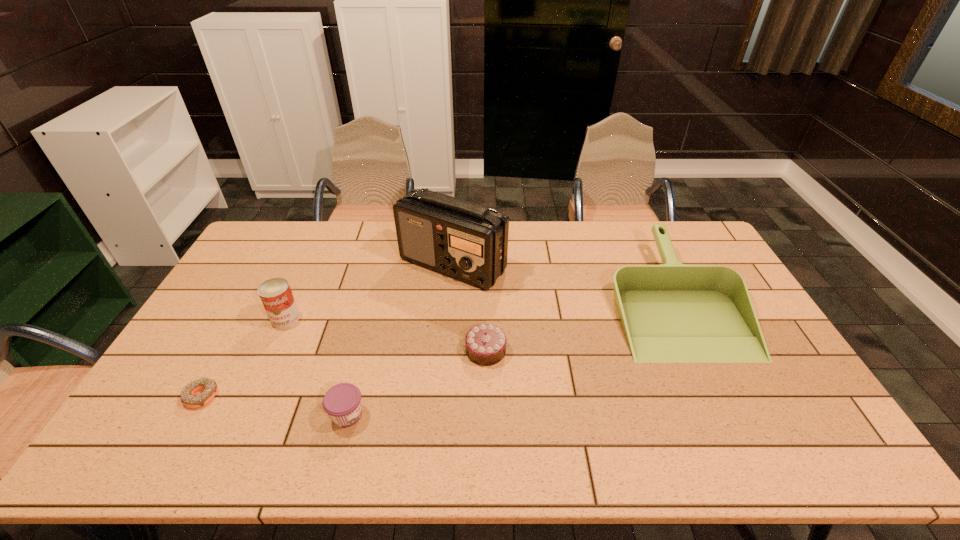
You are a GUI agent. You are given a task and a screenshot of the screen. Output one action in this format:
    pyautogui.click(x=<x>, y=<y>)
    Task: Click on the unoccupied position between the dustpan and the can
    This screenshot has height=540, width=960.
    Given the screenshot: What is the action you would take?
    pyautogui.click(x=479, y=308)

Locate an element on the screen. free space between the tallest object and the jam is located at coordinates (400, 340).

This screenshot has height=540, width=960. What are the coordinates of `unoccupied area between the rightmost object and the chocolate cake` in the screenshot? It's located at (580, 325).

At what (x,y) coordinates should I click in order to perform the action: click on vacant space that is in between the shortest object and the chocolate cake. Please return your answer as a coordinate pair (x, y). Looking at the image, I should click on (344, 373).

Where is `object that ranks as the closest to the radio receiver`? object that ranks as the closest to the radio receiver is located at coordinates (485, 344).

Locate an element on the screen. The height and width of the screenshot is (540, 960). the closest object to the can is located at coordinates (188, 399).

Locate an element on the screen. The height and width of the screenshot is (540, 960). free location that satisfies the following two spatial constraints: 1. on the front label of the can; 2. on the left side of the chocolate cake is located at coordinates (271, 350).

Identify the location of free space that satisfies the following two spatial constraints: 1. on the front label of the chocolate cake; 2. on the left side of the second object from left to right. (271, 350).

Where is `free space that satisfies the following two spatial constraints: 1. on the scoop of the dustpan; 2. on the front label of the jam`? free space that satisfies the following two spatial constraints: 1. on the scoop of the dustpan; 2. on the front label of the jam is located at coordinates (729, 415).